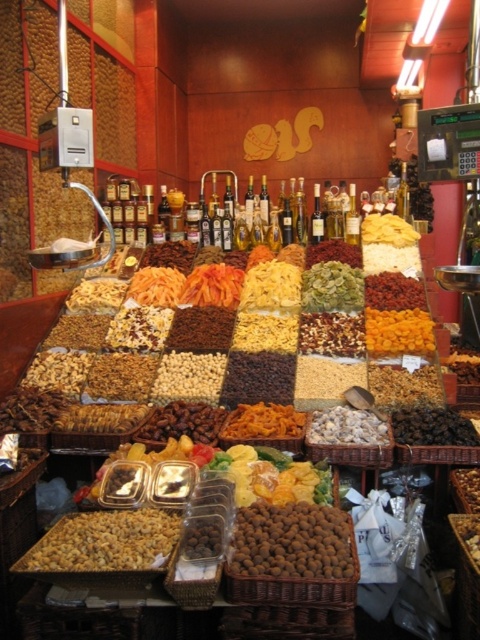
Between brown crunchy nuts at lower left and dark brown dried fruit at center, which one appears on the left side from the viewer's perspective?

Positioned to the left is brown crunchy nuts at lower left.

Is brown crunchy nuts at lower left behind dark brown dried fruit at center?

No, it is in front of dark brown dried fruit at center.

Image resolution: width=480 pixels, height=640 pixels. I want to click on brown crunchy nuts at lower left, so click(x=107, y=541).

Can you confirm if brown crunchy nuts at lower left is taller than brown textured nuts at center?

Indeed, brown crunchy nuts at lower left has a greater height compared to brown textured nuts at center.

Is brown crunchy nuts at lower left to the right of brown textured nuts at center from the viewer's perspective?

No, brown crunchy nuts at lower left is not to the right of brown textured nuts at center.

You are a GUI agent. You are given a task and a screenshot of the screen. Output one action in this format:
    pyautogui.click(x=<x>, y=<y>)
    Task: Click on the brown crunchy nuts at lower left
    The height and width of the screenshot is (640, 480).
    Given the screenshot: What is the action you would take?
    click(107, 541)

Does brown crunchy nuts at lower left have a greater width compared to orange dried fruit at center?

Indeed, brown crunchy nuts at lower left has a greater width compared to orange dried fruit at center.

Is brown crunchy nuts at lower left taller than orange dried fruit at center?

No.

Which is behind, point (74, 529) or point (237, 429)?

Positioned behind is point (237, 429).

In order to click on brown crunchy nuts at lower left in this screenshot , I will do `click(107, 541)`.